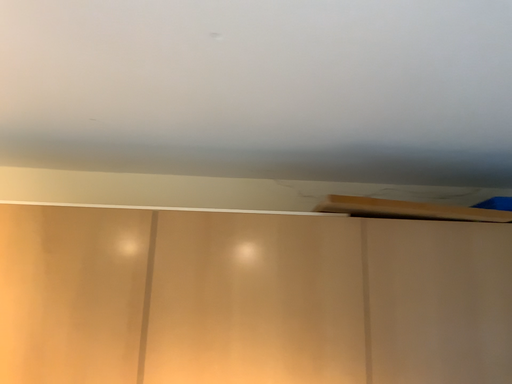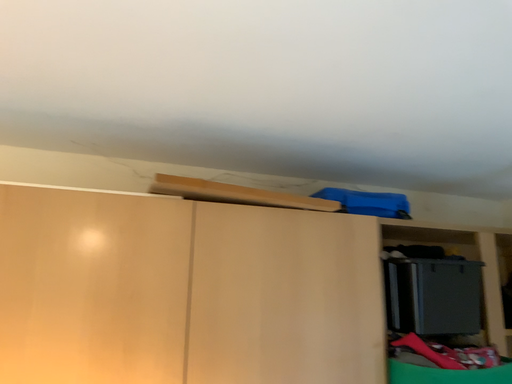
Question: How did the camera likely rotate when shooting the video?

Choices:
 (A) rotated left
 (B) rotated right

Answer: (B)